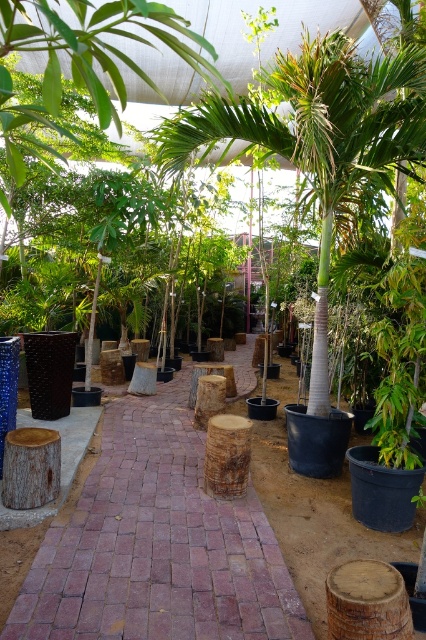
Who is taller, brick paved path at center or green leafy palm tree at center?

green leafy palm tree at center

Who is more forward, (161,506) or (284,67)?

Point (161,506) is more forward.

Which is in front, point (140, 531) or point (379, 132)?

Point (140, 531)

Where is `brick paved path at center`? This screenshot has width=426, height=640. brick paved path at center is located at coordinates (157, 545).